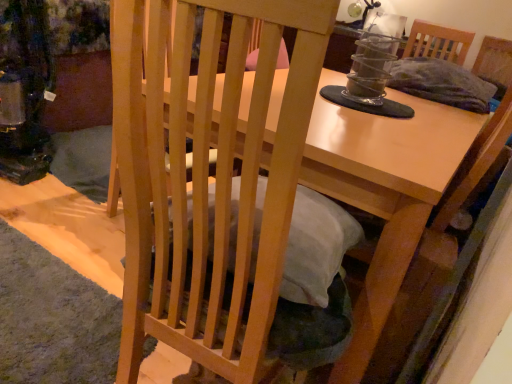
Measure the distance between natural wood chair at center and camera.

44.38 centimeters.

What do you see at coordinates (207, 177) in the screenshot? I see `natural wood chair at center` at bounding box center [207, 177].

In order to face natural wood chair at center, should I rotate leftwards or rightwards?

Rotate your view left by about 2.895°.

Locate an element on the screen. This screenshot has height=384, width=512. natural wood chair at center is located at coordinates (207, 177).

The image size is (512, 384). What are the coordinates of `light brown wooden table at center` in the screenshot? It's located at (398, 205).

Describe the element at coordinates (398, 205) in the screenshot. The height and width of the screenshot is (384, 512). I see `light brown wooden table at center` at that location.

At what (x,y) coordinates should I click in order to perform the action: click on natural wood chair at center. Please return your answer as a coordinate pair (x, y). Looking at the image, I should click on (207, 177).

Is natural wood chair at center at the left side of light brown wooden table at center?

Yes, natural wood chair at center is to the left of light brown wooden table at center.

Does natural wood chair at center come behind light brown wooden table at center?

No, it is not.

Does point (160, 12) come closer to viewer compared to point (437, 176)?

Yes, it is.

From the image's perspective, who appears lower, natural wood chair at center or light brown wooden table at center?

natural wood chair at center, from the image's perspective.

From a real-world perspective, is natural wood chair at center positioned over light brown wooden table at center based on gravity?

Correct, in the physical world, natural wood chair at center is higher than light brown wooden table at center.

Between natural wood chair at center and light brown wooden table at center, which one has larger width?

With larger width is light brown wooden table at center.

Considering the sizes of objects natural wood chair at center and light brown wooden table at center in the image provided, who is shorter, natural wood chair at center or light brown wooden table at center?

light brown wooden table at center.

Based on their sizes in the image, would you say natural wood chair at center is bigger or smaller than light brown wooden table at center?

In the image, natural wood chair at center appears to be smaller than light brown wooden table at center.

Could light brown wooden table at center be considered to be inside natural wood chair at center?

No, light brown wooden table at center is not a part of natural wood chair at center.

Looking at this image, is natural wood chair at center with light brown wooden table at center?

No, natural wood chair at center is not next to light brown wooden table at center.

Is light brown wooden table at center at the back of natural wood chair at center?

No, natural wood chair at center is not facing away from light brown wooden table at center.

Can you tell me how much natural wood chair at center and light brown wooden table at center differ in facing direction?

85.5 degrees.

Where is `table behind the natural wood chair at center`? table behind the natural wood chair at center is located at coordinates (398, 205).

Which is more to the left, light brown wooden table at center or natural wood chair at center?

natural wood chair at center.

Is the depth of light brown wooden table at center less than that of natural wood chair at center?

No, the depth of light brown wooden table at center is greater than that of natural wood chair at center.

Which point is more distant from viewer, (360, 165) or (278, 203)?

Positioned behind is point (360, 165).

From the image's perspective, who appears lower, light brown wooden table at center or natural wood chair at center?

natural wood chair at center.

From a real-world perspective, between light brown wooden table at center and natural wood chair at center, who is vertically higher?

natural wood chair at center is physically above.

Looking at this image, considering the sizes of objects light brown wooden table at center and natural wood chair at center in the image provided, who is wider, light brown wooden table at center or natural wood chair at center?

light brown wooden table at center is wider.

Can you confirm if light brown wooden table at center is taller than natural wood chair at center?

No.

Which of these two, light brown wooden table at center or natural wood chair at center, is smaller?

With smaller size is natural wood chair at center.

In the scene shown: Which is correct: light brown wooden table at center is inside natural wood chair at center, or outside of it?

light brown wooden table at center is not inside natural wood chair at center, it's outside.

Is light brown wooden table at center far from natural wood chair at center?

That's not correct — light brown wooden table at center is a little close to natural wood chair at center.

Could you tell me if light brown wooden table at center is facing natural wood chair at center?

No, light brown wooden table at center is not facing towards natural wood chair at center.

How many degrees apart are the facing directions of light brown wooden table at center and natural wood chair at center?

The facing directions of light brown wooden table at center and natural wood chair at center are 85.5 degrees apart.

Where is `table on the right of natural wood chair at center`? table on the right of natural wood chair at center is located at coordinates (398, 205).

Where is `table above the natural wood chair at center (from the image's perspective)`? Image resolution: width=512 pixels, height=384 pixels. table above the natural wood chair at center (from the image's perspective) is located at coordinates (398, 205).

This screenshot has height=384, width=512. Identify the location of chair below the light brown wooden table at center (from the image's perspective). (207, 177).